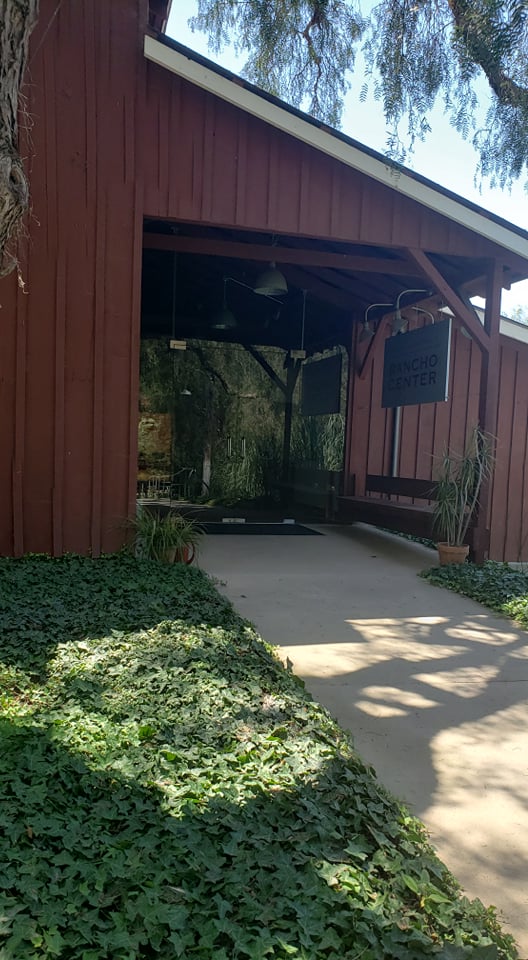
Where is `doors`? Image resolution: width=528 pixels, height=960 pixels. doors is located at coordinates (195, 428), (254, 409).